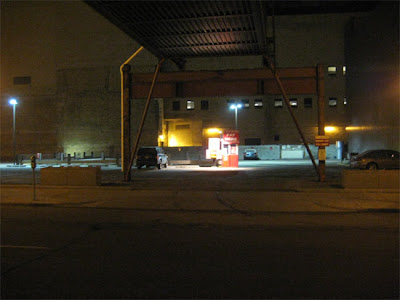
Where is `light source`? The width and height of the screenshot is (400, 300). light source is located at coordinates (212, 130), (174, 141), (162, 140), (330, 128).